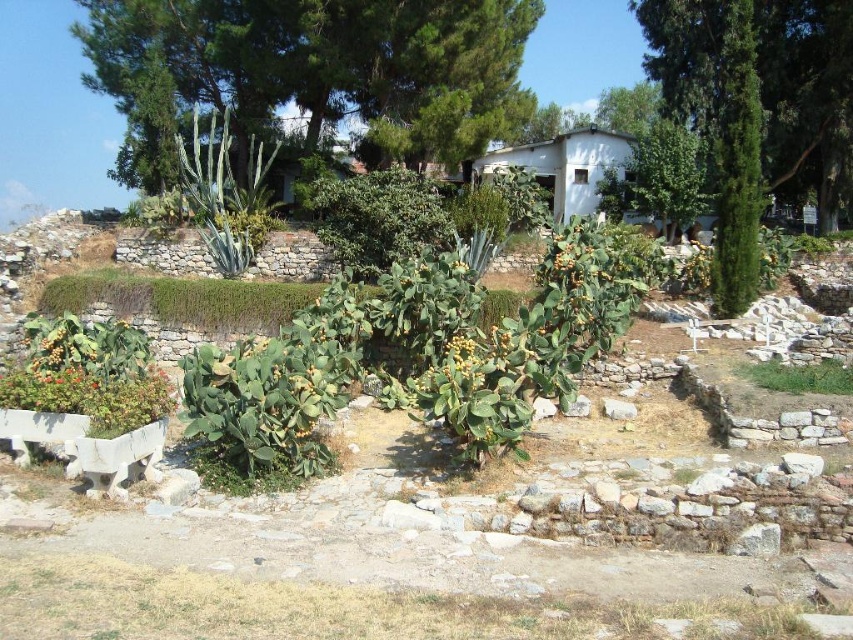
Can you confirm if green leafy tree at upper center is positioned above green leafy tree at upper right?

Yes, green leafy tree at upper center is above green leafy tree at upper right.

Describe the element at coordinates (329, 64) in the screenshot. Image resolution: width=853 pixels, height=640 pixels. I see `green leafy tree at upper center` at that location.

Find the location of a particular element. The width and height of the screenshot is (853, 640). green leafy tree at upper center is located at coordinates (x=329, y=64).